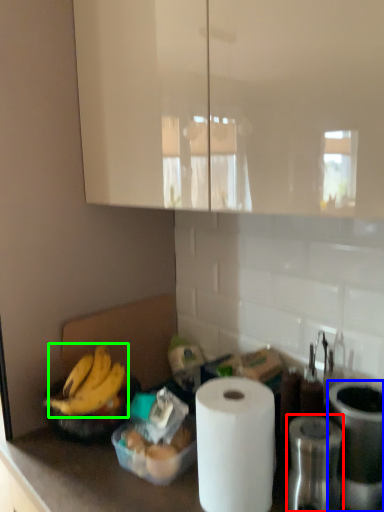
Question: Which is farther away from appliance (highlighted by a red box)? appliance (highlighted by a blue box) or banana (highlighted by a green box)?

Choices:
 (A) appliance
 (B) banana

Answer: (B)